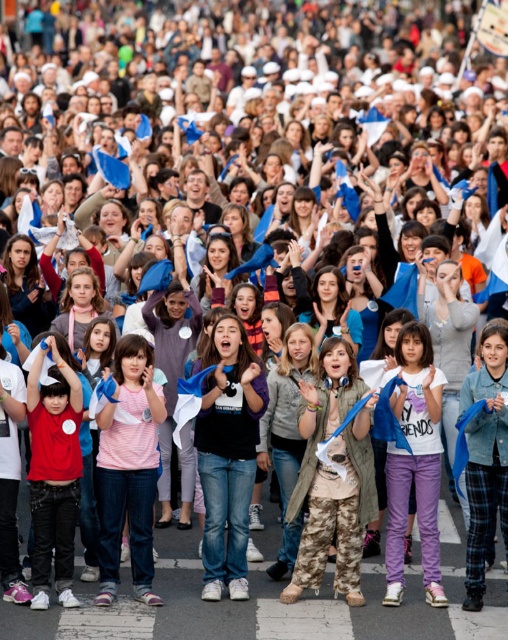
You are a photographer trying to capture a photo of the camouflage pants at center and the matte red shirt at left. Based on their heights, which one should you focus on first to ensure both are in frame?

The camouflage pants at center is not as tall as matte red shirt at left, so you should focus on the matte red shirt at left first to ensure both are in frame.

You are a photographer at the event and need to capture a photo that includes both the camouflage pants at center and the pink fabric shirt at center. Which object should you focus on first to ensure both are in frame?

The camouflage pants at center is shorter than the pink fabric shirt at center, so you should focus on the pink fabric shirt at center first to ensure both are in frame.

You are a photographer at the event and want to capture both the camouflage pants at center and the pink fabric shirt at center in a single frame. Which object should you focus on first to ensure both are in the frame?

The camouflage pants at center is smaller than the pink fabric shirt at center, so you should focus on the pink fabric shirt at center first to ensure both are in the frame.